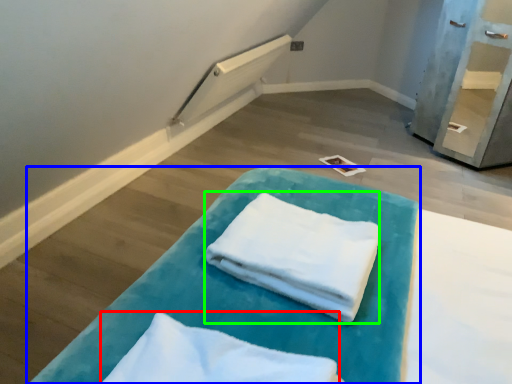
Question: Considering the real-world distances, which object is farthest from cloth (highlighted by a red box)? furniture (highlighted by a blue box) or cloth (highlighted by a green box)?

Choices:
 (A) furniture
 (B) cloth

Answer: (B)